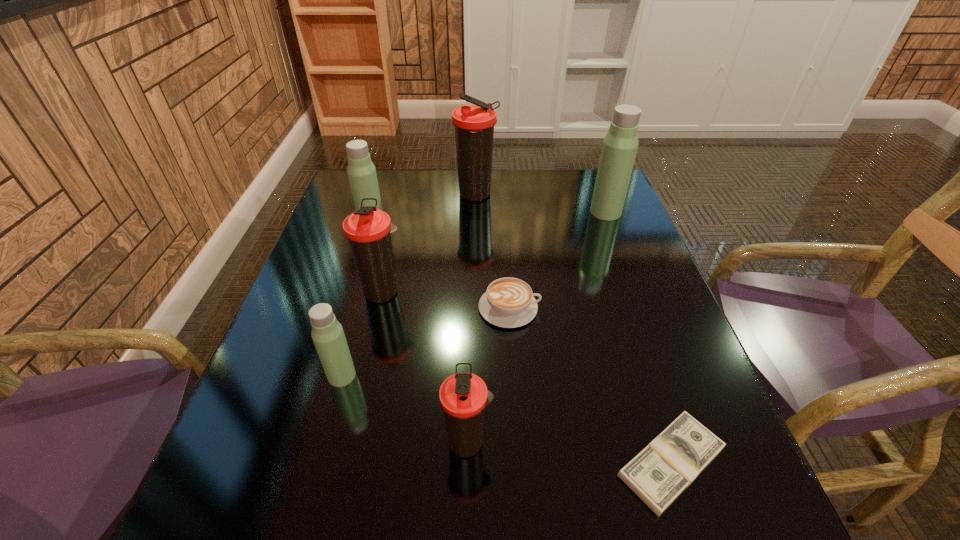
This screenshot has width=960, height=540. I want to click on vacant space that satisfies the following two spatial constraints: 1. on the front side of the shortest object; 2. on the left side of the smallest light thermos bottle, so click(x=318, y=463).